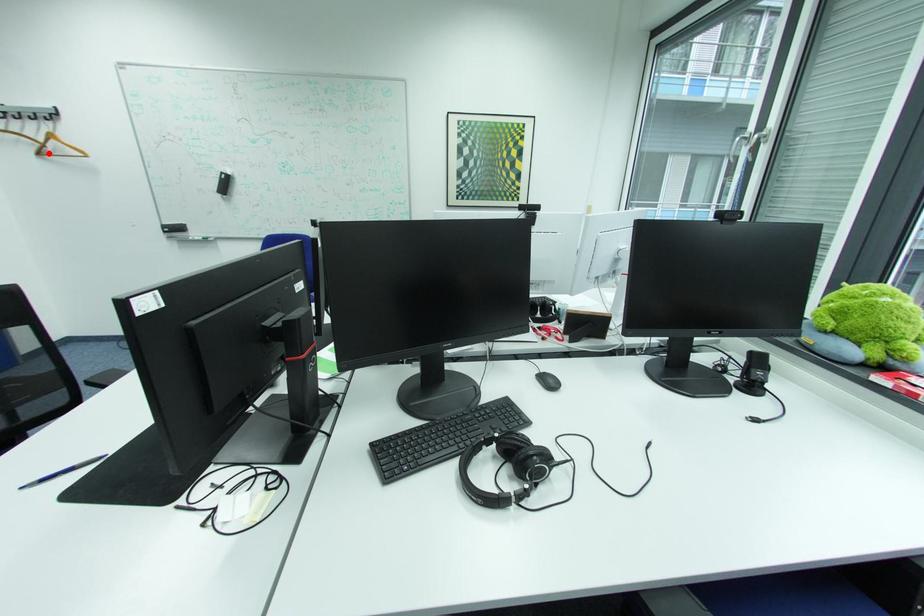
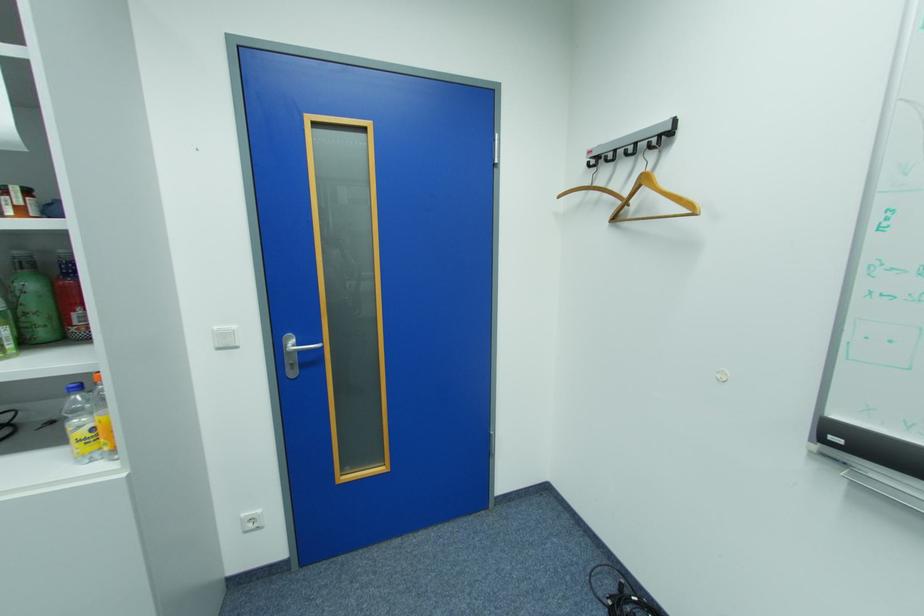
Find the pixel in the second image that matches the highlighted location in the first image.

(624, 220)